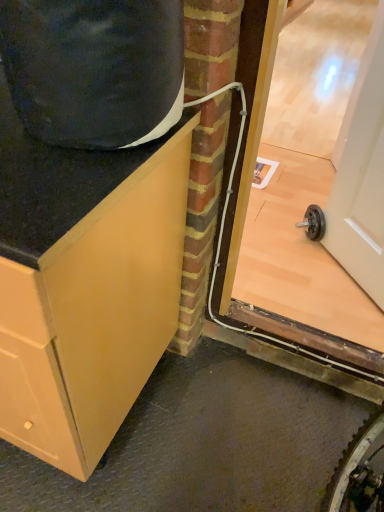
Question: In the image, is white glossy door at upper right on the left side or the right side of transparent glass door at right?

Choices:
 (A) left
 (B) right

Answer: (B)

Question: In terms of width, does white glossy door at upper right look wider or thinner when compared to transparent glass door at right?

Choices:
 (A) wide
 (B) thin

Answer: (B)

Question: Which object is the closest to the matte wood cabinet at left?

Choices:
 (A) white glossy door at upper right
 (B) transparent glass door at right

Answer: (A)

Question: Which is farther from the matte wood cabinet at left?

Choices:
 (A) transparent glass door at right
 (B) white glossy door at upper right

Answer: (A)